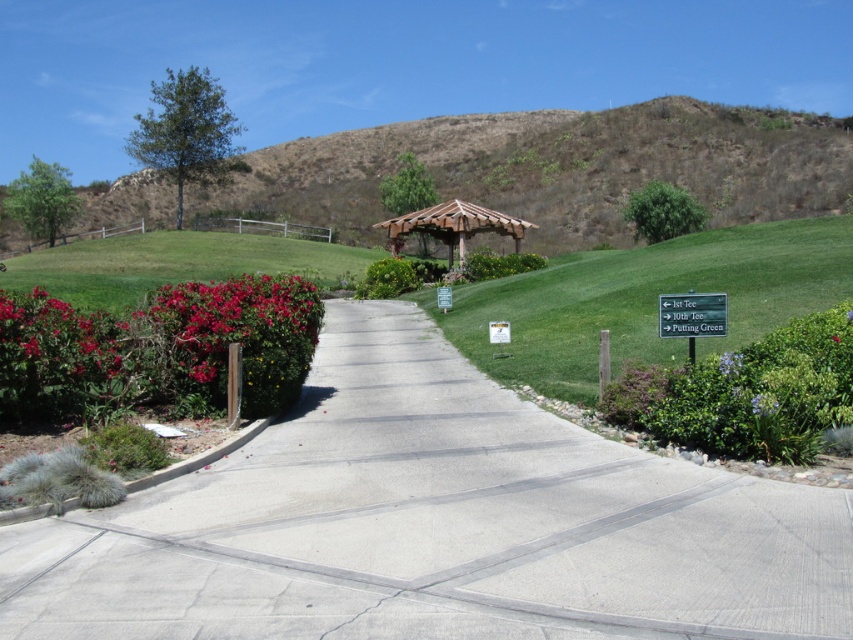
Between point (677, 122) and point (817, 232), which one is positioned behind?

The point (677, 122) is behind.

In order to click on brown grassy hillside at upper center in this screenshot , I will do `click(558, 168)`.

Is brown grassy hillside at upper center positioned at the back of wooden gazebo at center?

Yes, brown grassy hillside at upper center is further from the viewer.

Locate an element on the screen. This screenshot has height=640, width=853. brown grassy hillside at upper center is located at coordinates (558, 168).

The width and height of the screenshot is (853, 640). Find the location of `brown grassy hillside at upper center`. brown grassy hillside at upper center is located at coordinates (558, 168).

You are a GUI agent. You are given a task and a screenshot of the screen. Output one action in this format:
    pyautogui.click(x=<x>, y=<y>)
    Task: Click on the brown grassy hillside at upper center
    The image size is (853, 640).
    Given the screenshot: What is the action you would take?
    pyautogui.click(x=558, y=168)

Is shiny red flowers at left bigger than glossy red flowers at left?

Yes, shiny red flowers at left is bigger than glossy red flowers at left.

Which is in front, point (260, 339) or point (39, 336)?

Point (39, 336) is in front.

Does point (300, 374) lie behind point (48, 358)?

That is True.

The image size is (853, 640). What are the coordinates of `shiny red flowers at left` in the screenshot? It's located at (236, 330).